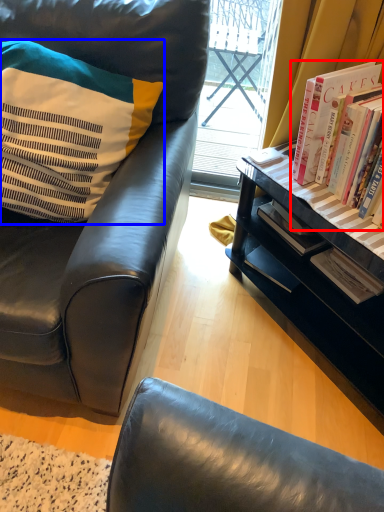
Question: Which object appears closest to the camera in this image, book (highlighted by a red box) or pillow (highlighted by a blue box)?

Choices:
 (A) book
 (B) pillow

Answer: (B)